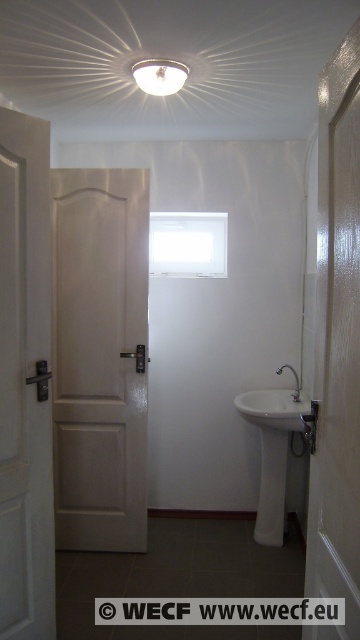
You are standing in the bathroom and want to exit through the door. Based on the scene description, which direction should you move towards to reach the white matte door at left from the matte white light fixture at upper center?

The white matte door at left is located below the matte white light fixture at upper center, so you should move downward towards the white matte door at left to exit.

You are standing in the bathroom and want to turn on the matte silver faucet at center right. To reach it, you need to pass through the white glossy door at center. Is the door blocking your path to the faucet?

The white glossy door at center is in front of the matte silver faucet at center right, so the door is blocking your path to the faucet.